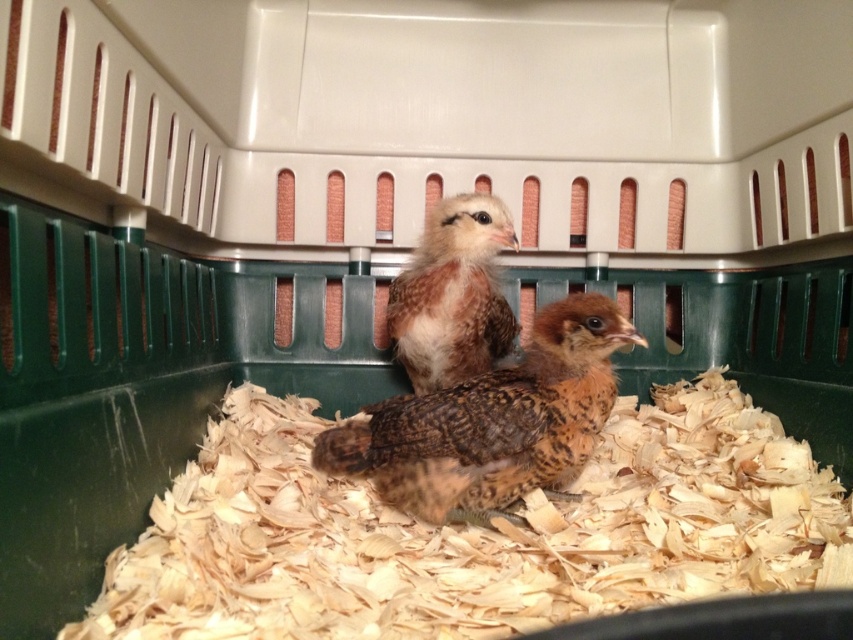
Does brown speckled feathers at center appear under brown speckled feather at center?

Yes, brown speckled feathers at center is below brown speckled feather at center.

Identify the location of brown speckled feathers at center. The width and height of the screenshot is (853, 640). click(x=492, y=422).